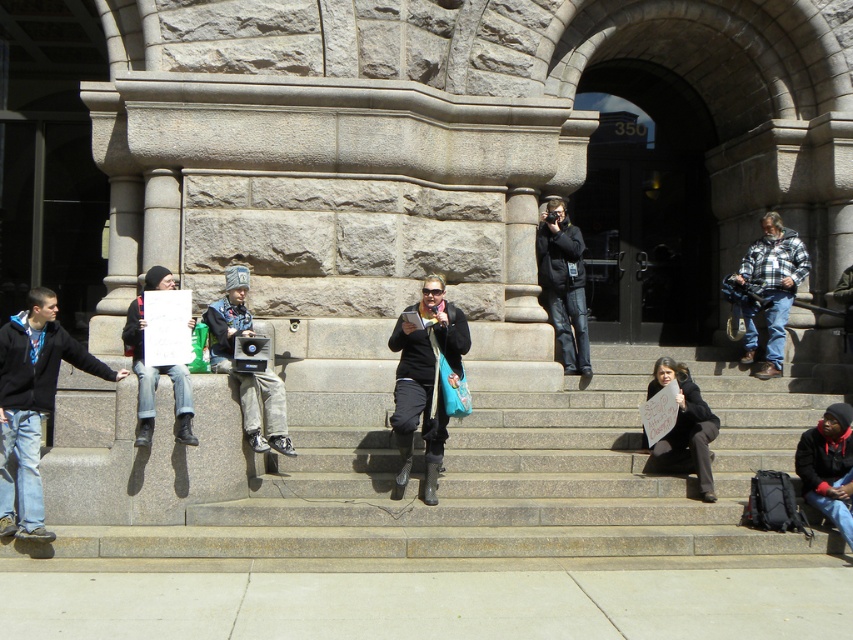
You are standing at the entrance of the building and want to move towards the point labeled as point (820, 429). Is the point labeled point (763, 296) located behind you or in front of you?

The point labeled point (763, 296) is behind point (820, 429), so if you are moving towards point (820, 429) from the entrance, the point (763, 296) would be behind you.

You are a photographer standing at the center of the scene. You want to take a photo that includes both the black fleece jacket at lower right and the matte black jacket at left. What is the minimum distance you need to move to ensure both are in frame?

The black fleece jacket at lower right and matte black jacket at left are 5.35 meters apart. To include both in the frame, you need to move back until the camera can capture a wide enough angle to encompass the 5.35 meters between them.

You are organizing a protest and need to decide which jacket to wear for visibility. Considering the sizes of the black fleece jacket at lower right and the matte black jacket at left, which one would be more visible to the crowd?

The matte black jacket at left is larger in size compared to the black fleece jacket at lower right, so it would be more visible to the crowd.